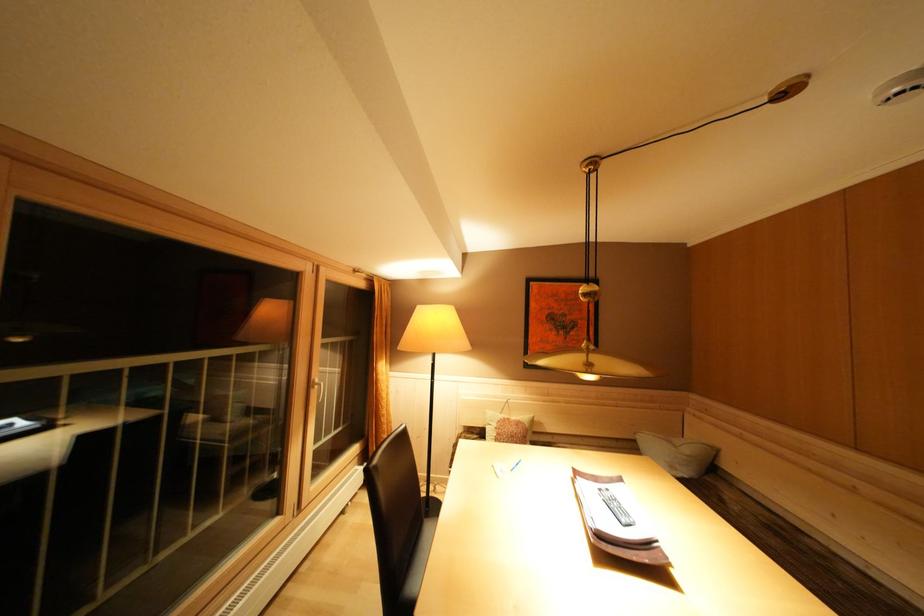
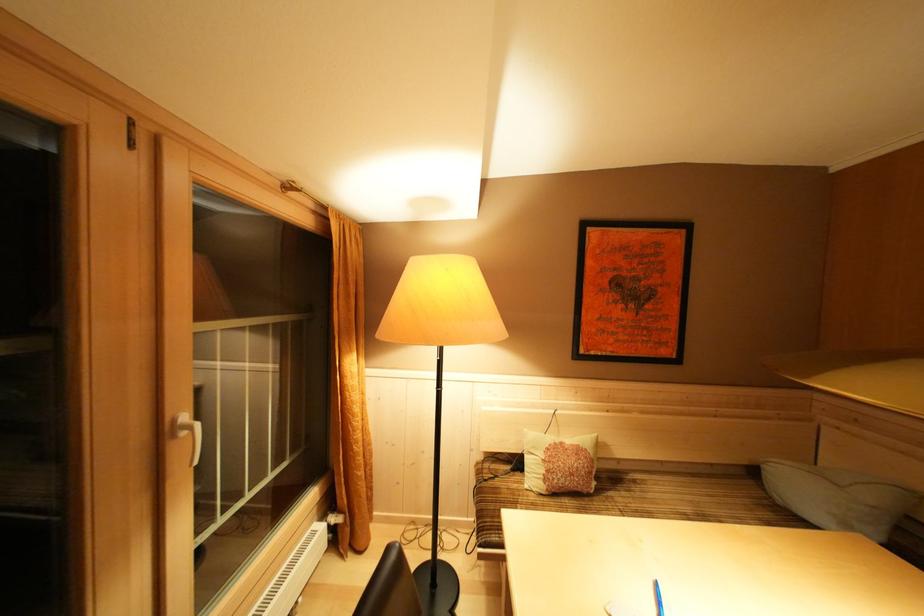
The point at (406, 353) is marked in the first image. Where is the corresponding point in the second image?

(385, 339)